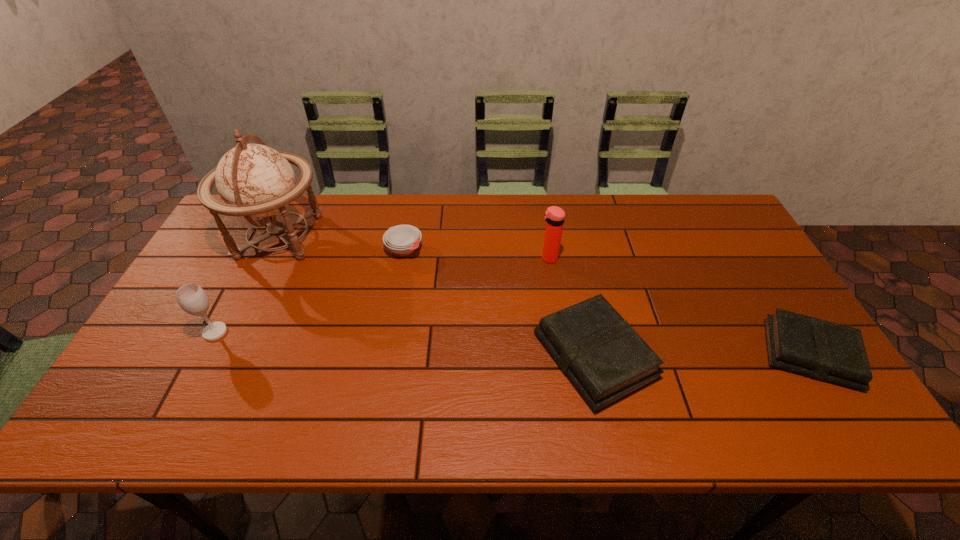
In order to click on the taller book in this screenshot , I will do `click(605, 359)`.

Identify the location of the third shortest object. (605, 359).

This screenshot has height=540, width=960. Identify the location of the rightmost object. (818, 349).

Where is `the shorter book`? Image resolution: width=960 pixels, height=540 pixels. the shorter book is located at coordinates (818, 349).

You are a GUI agent. You are given a task and a screenshot of the screen. Output one action in this format:
    pyautogui.click(x=<x>, y=<y>)
    Task: Click on the soup bowl
    This screenshot has width=960, height=540.
    Given the screenshot: What is the action you would take?
    pyautogui.click(x=402, y=239)

The height and width of the screenshot is (540, 960). Identify the location of wineglass. (192, 298).

This screenshot has width=960, height=540. Identify the location of the tallest object. (254, 180).

This screenshot has height=540, width=960. In order to click on thermos bottle in this screenshot , I will do `click(554, 216)`.

Where is `vacant space located on the back of the left book`? This screenshot has height=540, width=960. vacant space located on the back of the left book is located at coordinates (577, 274).

Locate an element on the screen. vacant space situated 0.320m on the left of the right book is located at coordinates (633, 354).